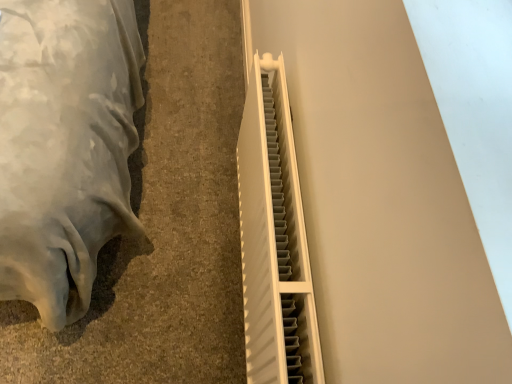
Find the location of `white plastic radiator at center`. white plastic radiator at center is located at coordinates (274, 238).

This screenshot has height=384, width=512. Describe the element at coordinates (274, 238) in the screenshot. I see `white plastic radiator at center` at that location.

Where is `white plastic radiator at center`? Image resolution: width=512 pixels, height=384 pixels. white plastic radiator at center is located at coordinates (274, 238).